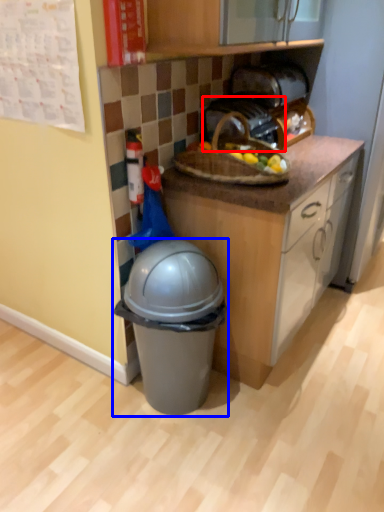
Question: Which object appears closest to the camera in this image, toaster (highlighted by a red box) or trash bin/can (highlighted by a blue box)?

Choices:
 (A) toaster
 (B) trash bin/can

Answer: (B)